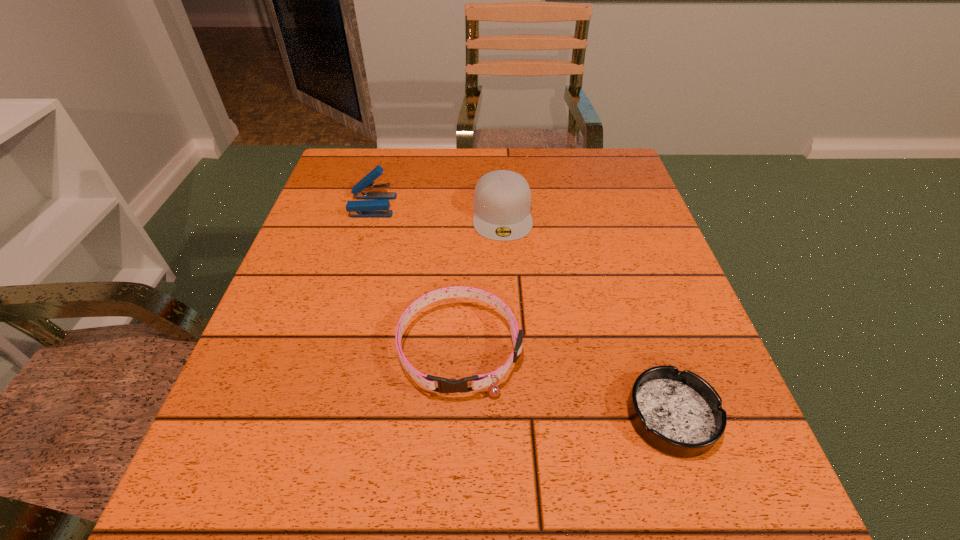
Identify the location of vacant region at the far right corner. Image resolution: width=960 pixels, height=540 pixels. (584, 192).

I want to click on vacant point located between the dog collar and the shortest object, so click(x=565, y=382).

The height and width of the screenshot is (540, 960). Find the location of `free space between the stapler and the dog collar`. free space between the stapler and the dog collar is located at coordinates (417, 276).

Locate an element on the screen. unoccupied area between the cap and the stapler is located at coordinates (438, 210).

Find the location of a particular element. The height and width of the screenshot is (540, 960). free point between the leftmost object and the ashtray is located at coordinates (522, 310).

At what (x,y) coordinates should I click in order to perform the action: click on vacant space that is in between the ashtray and the leftmost object. Please return your answer as a coordinate pair (x, y). This screenshot has width=960, height=540. Looking at the image, I should click on (522, 310).

Locate an element on the screen. The width and height of the screenshot is (960, 540). free spot between the shortest object and the third tallest object is located at coordinates (565, 382).

The image size is (960, 540). In order to click on vacant area between the dog collar and the shortest object in this screenshot , I will do `click(565, 382)`.

Identify the location of vacant point located between the dog collar and the cap. The image size is (960, 540). (481, 281).

Identify the location of unoccupied position between the second shortest object and the leftmost object. This screenshot has height=540, width=960. (417, 276).